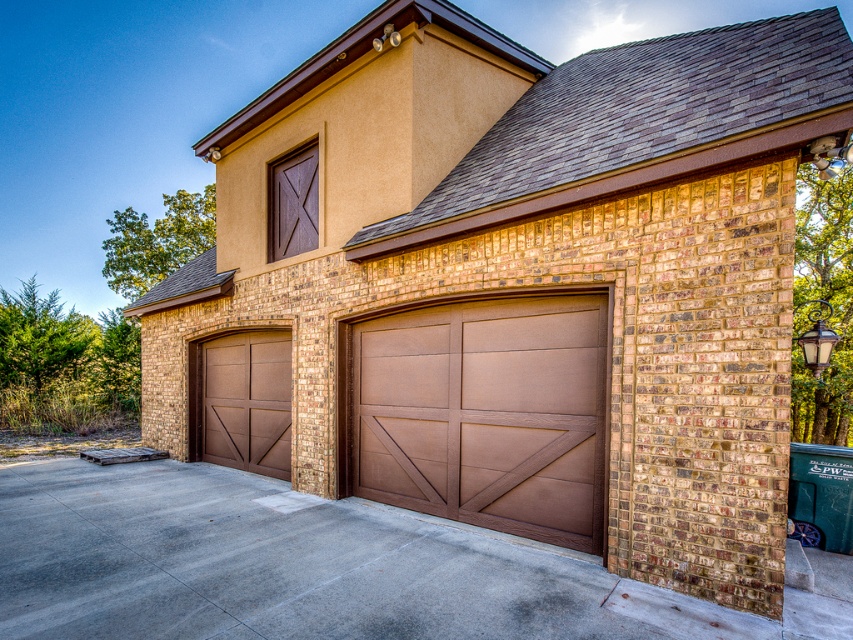
Does brown woodgrain garage door at center have a lesser height compared to brown wood door at left?

Incorrect, brown woodgrain garage door at center's height does not fall short of brown wood door at left's.

Between brown woodgrain garage door at center and brown wood door at left, which one has more height?

With more height is brown woodgrain garage door at center.

Between point (456, 506) and point (200, 451), which one is positioned behind?

Positioned behind is point (200, 451).

I want to click on brown woodgrain garage door at center, so coord(485,413).